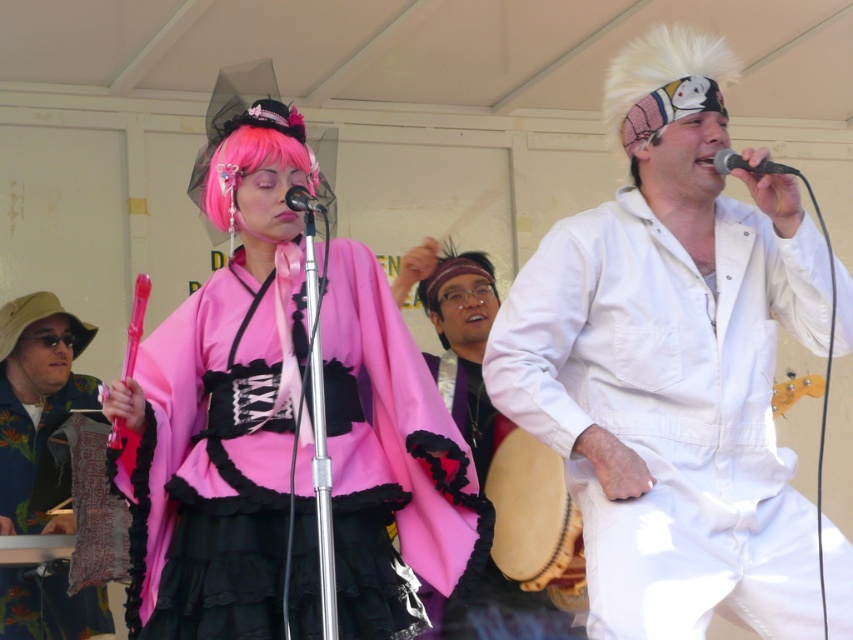
Question: Is black metallic microphone at upper right above matte black microphone at center?

Choices:
 (A) no
 (B) yes

Answer: (B)

Question: Which is nearer to the white matte jumpsuit at center?

Choices:
 (A) textured fabric at left
 (B) black metallic microphone at upper right
 (C) matte pink kimono at center
 (D) light brown wooden drum at lower center

Answer: (C)

Question: Estimate the real-world distances between objects in this image. Which object is closer to the textured fabric at left?

Choices:
 (A) black metallic microphone at upper right
 (B) matte pink kimono at center

Answer: (B)

Question: Is white matte jumpsuit at center positioned at the back of textured fabric at left?

Choices:
 (A) no
 (B) yes

Answer: (A)

Question: Observing the image, what is the correct spatial positioning of matte pink kimono at center in reference to light brown wooden drum at lower center?

Choices:
 (A) left
 (B) right

Answer: (A)

Question: Based on their relative distances, which object is nearer to the black metallic microphone at upper right?

Choices:
 (A) matte black microphone at center
 (B) matte white jumpsuit at center

Answer: (A)